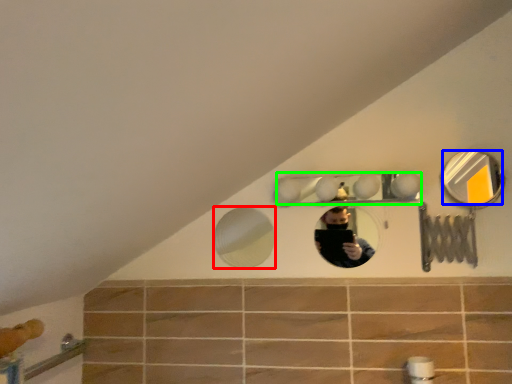
Question: Which object is positioned farthest from mirror (highlighted by a red box)? Select from mirror (highlighted by a blue box) and mirror (highlighted by a green box).

Choices:
 (A) mirror
 (B) mirror

Answer: (B)